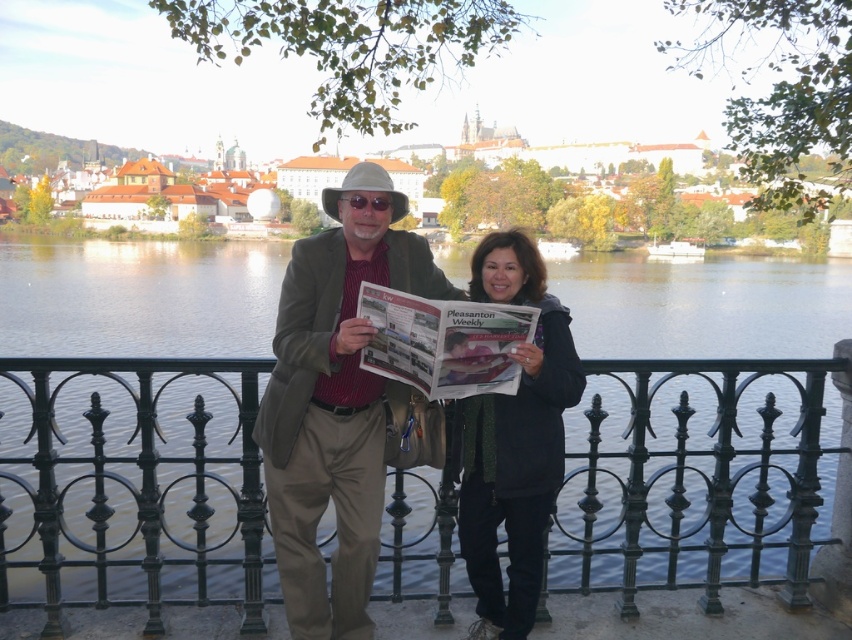
You are a photographer standing at the edge of the railing trying to capture the cityscape behind the two people. The khaki cotton pants at center and the camera are 31.63 meters apart. If your camera has a maximum zoom range of 20 meters, can you still take a clear photo of the cityscape without moving closer?

The khaki cotton pants at center and the camera are 31.63 meters apart. Since the camera has a maximum zoom range of 20 meters, it cannot capture details beyond that distance. Therefore, you cannot take a clear photo of the cityscape without moving closer.

Consider the image. You are a photographer trying to capture a clear shot of the dark gray jacket at center and the black wrought iron railing at center. Based on their heights, which object should you focus on first to ensure both are in frame?

The black wrought iron railing at center has a lesser height compared to dark gray jacket at center, so you should focus on the dark gray jacket at center first to ensure both are in frame.